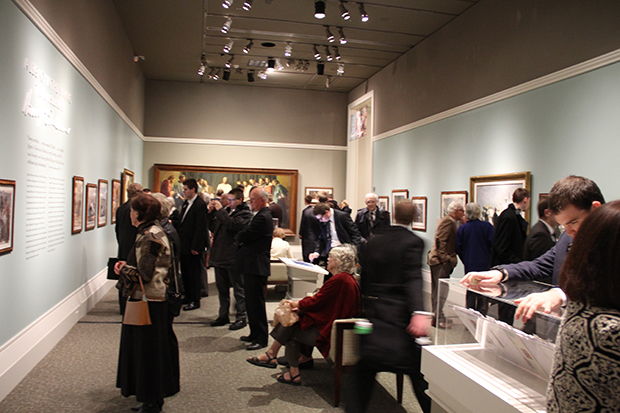
Find the location of a particular element. This screenshot has width=620, height=413. left wall of art gallery is located at coordinates (23, 291), (55, 275).